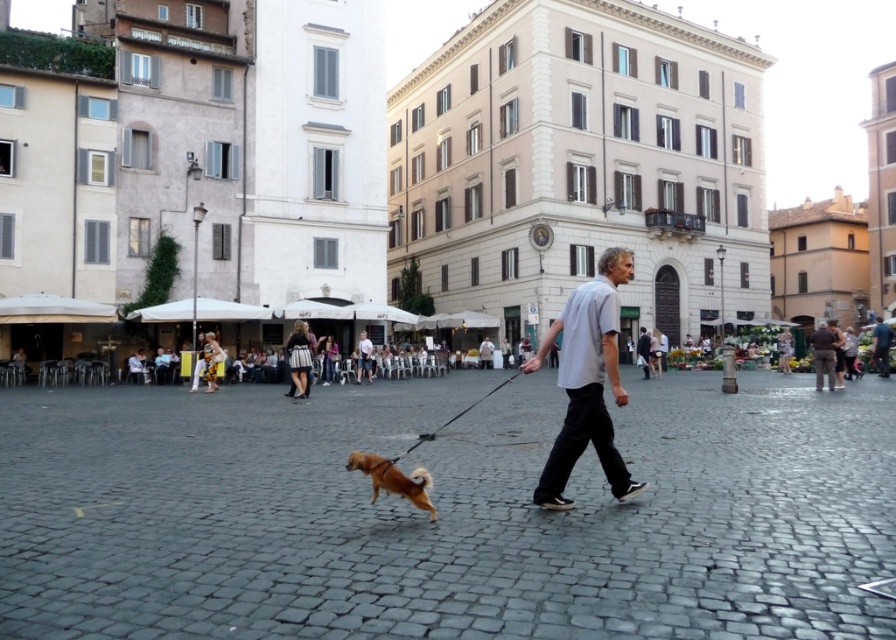
Does white cotton shirt at center have a smaller size compared to golden fur dog at center?

No.

Which is in front, point (621, 280) or point (366, 460)?

Point (366, 460) is in front.

At what (x,y) coordinates should I click in order to perform the action: click on white cotton shirt at center. Please return your answer as a coordinate pair (x, y). Looking at the image, I should click on (586, 381).

Is white cotton shirt at center positioned in front of light gray cotton shirt at center?

Yes, white cotton shirt at center is in front of light gray cotton shirt at center.

Which is behind, point (625, 252) or point (362, 355)?

The point (362, 355) is more distant.

Does point (606, 413) lie behind point (360, 337)?

No, (606, 413) is in front of (360, 337).

Image resolution: width=896 pixels, height=640 pixels. What are the coordinates of `white cotton shirt at center` in the screenshot? It's located at (586, 381).

From the picture: Is golden fur dog at center positioned before light gray cotton shirt at center?

Yes, golden fur dog at center is in front of light gray cotton shirt at center.

Where is `golden fur dog at center`? The height and width of the screenshot is (640, 896). golden fur dog at center is located at coordinates (393, 480).

Who is more distant from viewer, (406,483) or (360,353)?

The point (360,353) is more distant.

The height and width of the screenshot is (640, 896). In order to click on golden fur dog at center in this screenshot , I will do `click(393, 480)`.